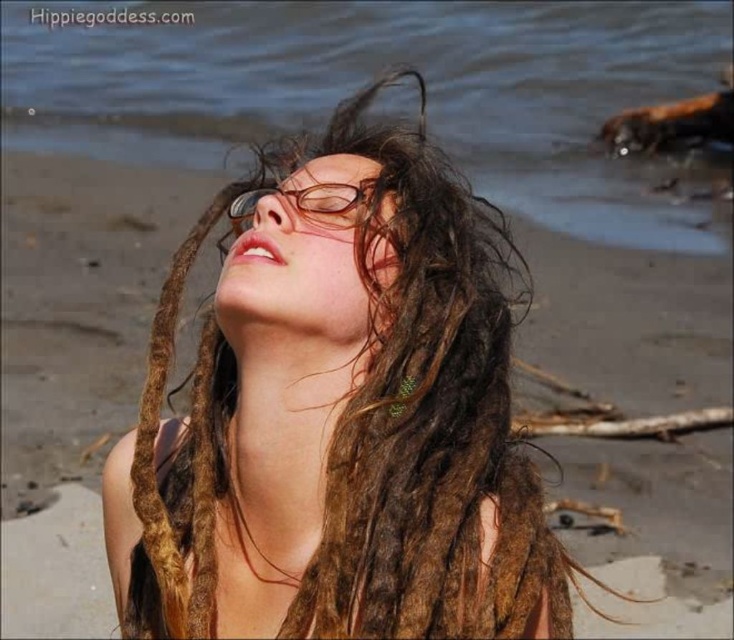
Can you confirm if brown dreadlocks at center is positioned above clear blue water at upper center?

Incorrect, brown dreadlocks at center is not positioned above clear blue water at upper center.

Which is more to the left, brown dreadlocks at center or clear blue water at upper center?

clear blue water at upper center is more to the left.

Which is in front, point (324, 456) or point (7, 132)?

Point (324, 456) is in front.

Identify the location of brown dreadlocks at center. The height and width of the screenshot is (640, 734). pyautogui.click(x=338, y=420).

Describe the element at coordinates (368, 80) in the screenshot. Image resolution: width=734 pixels, height=640 pixels. I see `clear blue water at upper center` at that location.

You are a GUI agent. You are given a task and a screenshot of the screen. Output one action in this format:
    pyautogui.click(x=<x>, y=<y>)
    Task: Click on the clear blue water at upper center
    The width and height of the screenshot is (734, 640).
    Given the screenshot: What is the action you would take?
    pyautogui.click(x=368, y=80)

Can you confirm if brown dreadlocks at center is smaller than brown plastic glasses at center?

Actually, brown dreadlocks at center might be larger than brown plastic glasses at center.

Which is behind, point (152, 561) or point (276, 196)?

The point (276, 196) is more distant.

Identify the location of brown dreadlocks at center. (338, 420).